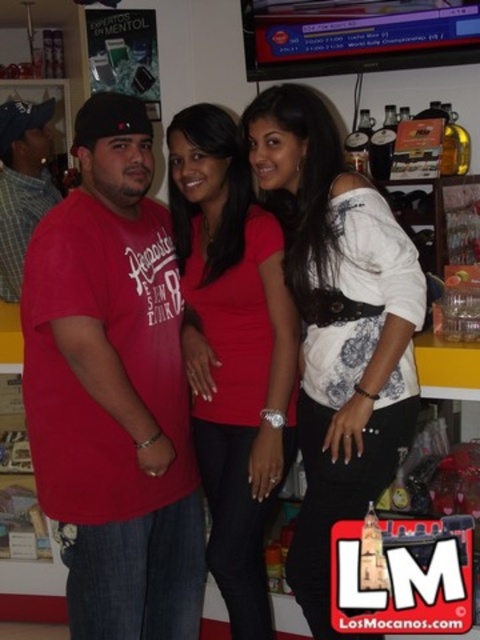
Which is behind, point (66, 317) or point (231, 637)?

The point (231, 637) is more distant.

Can you confirm if red cotton t-shirt at center is wider than matte red shirt at center?

Indeed, red cotton t-shirt at center has a greater width compared to matte red shirt at center.

Image resolution: width=480 pixels, height=640 pixels. Find the location of `red cotton t-shirt at center`. red cotton t-shirt at center is located at coordinates (113, 388).

Identify the location of red cotton t-shirt at center. The height and width of the screenshot is (640, 480). (113, 388).

Between red cotton t-shirt at center and white matte shirt at center, which one has more height?

Standing taller between the two is red cotton t-shirt at center.

Identify the location of red cotton t-shirt at center. Image resolution: width=480 pixels, height=640 pixels. (113, 388).

Can you confirm if red cotton t-shirt at center is thinner than matte red shirt at left?

No, red cotton t-shirt at center is not thinner than matte red shirt at left.

Find the location of a particular element. red cotton t-shirt at center is located at coordinates (113, 388).